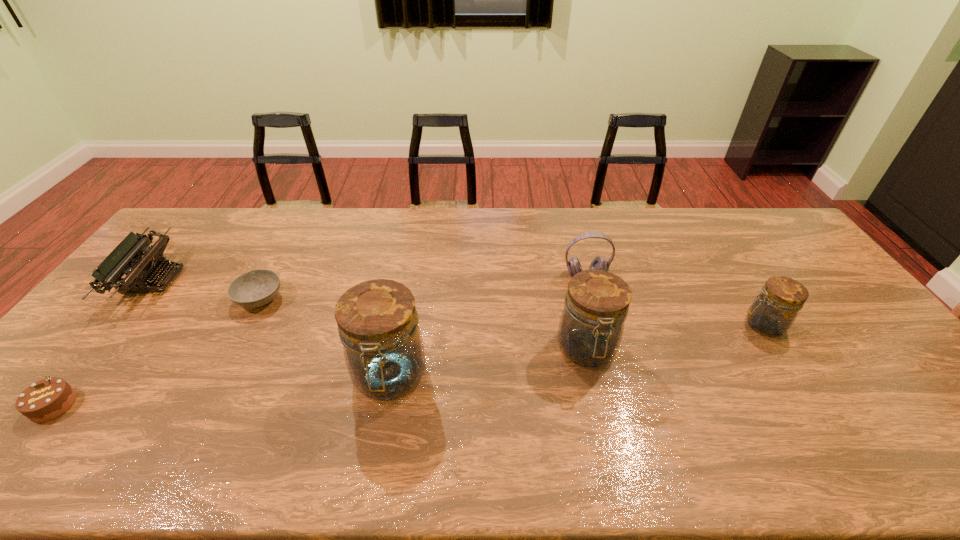
The image size is (960, 540). In order to click on vacant area situated 0.130m on the lid of the second tallest jar in this screenshot , I will do `click(604, 424)`.

At what (x,y) coordinates should I click in order to perform the action: click on blank area located 0.140m on the lid of the shortest jar. Please return your answer as a coordinate pair (x, y). The height and width of the screenshot is (540, 960). Looking at the image, I should click on (692, 325).

The image size is (960, 540). In order to click on vacant area located 0.080m on the lid of the shortest jar in this screenshot , I will do `click(713, 325)`.

The image size is (960, 540). In order to click on blank space located on the lid of the shortest jar in this screenshot , I will do `click(707, 325)`.

You are a GUI agent. You are given a task and a screenshot of the screen. Output one action in this format:
    pyautogui.click(x=<x>, y=<y>)
    Task: Click on the vacant area located 0.210m on the left of the third object from left to right
    This screenshot has width=960, height=540.
    Given the screenshot: What is the action you would take?
    pos(166,299)

The height and width of the screenshot is (540, 960). What are the coordinates of `vacant area situated 0.190m on the headband and ear cups of the headset` in the screenshot? It's located at (600, 328).

Identify the location of free space located 0.170m on the typing side of the fifth tallest object. (229, 280).

Find the location of a particular element. vacant area situated 0.160m on the back of the chocolate cake is located at coordinates (108, 339).

At what (x,y) coordinates should I click in order to perform the action: click on jar located at the near edge. Please return your answer as a coordinate pair (x, y). The height and width of the screenshot is (540, 960). Looking at the image, I should click on (378, 324).

You are a GUI agent. You are given a task and a screenshot of the screen. Output one action in this format:
    pyautogui.click(x=<x>, y=<y>)
    Task: Click on the chocolate cake positioned at the near edge
    
    Given the screenshot: What is the action you would take?
    pyautogui.click(x=47, y=399)